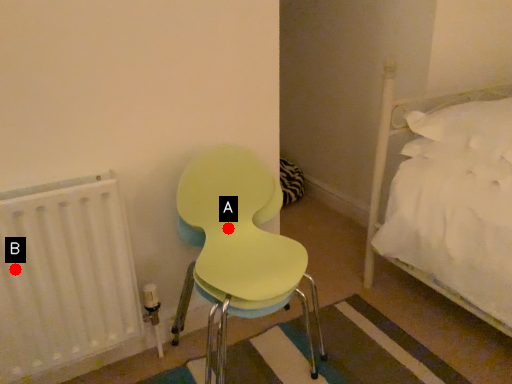
Question: Two points are circled on the image, labeled by A and B beside each circle. Which point is closer to the camera?

Choices:
 (A) A is closer
 (B) B is closer

Answer: (B)